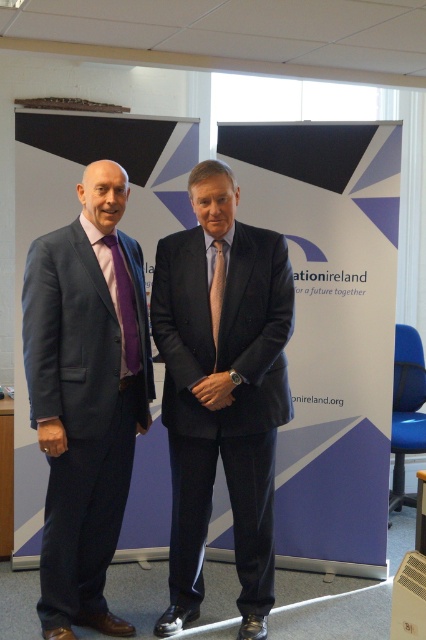
You are organizing a formal event and need to arrange the two items from the image, the matte blue suit at left and the purple satin tie at left, on a display rack. Which item should be placed on the left side of the display rack to match their positions in the original image?

The matte blue suit at left should be placed on the left side of the display rack because it is positioned on the left side of the purple satin tie at left in the original image.

You are a photographer setting up for a group photo. You need to ensure that all subjects fit within the camera frame. Given that the matte black suit at center is wider than the purple satin tie at left, which object should you focus on to frame both properly?

Since the matte black suit at center is wider than the purple satin tie at left, you should focus on the matte black suit at center as it requires more space in the frame to include both objects properly.